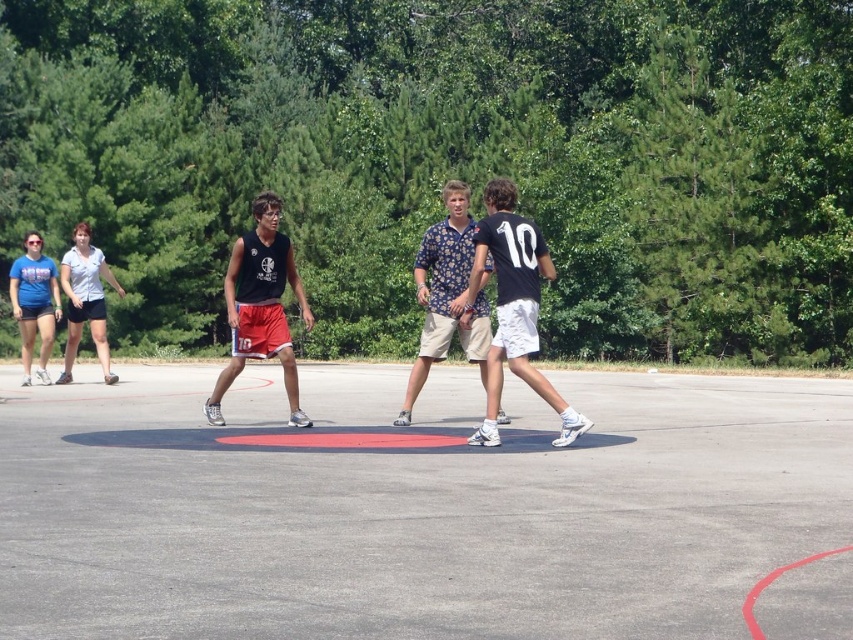
Is matte black tank top at center below matte blue t-shirt at left?

No, matte black tank top at center is not below matte blue t-shirt at left.

Measure the distance between matte black tank top at center and camera.

11.74 meters

Does point (293, 362) lie in front of point (41, 307)?

Yes.

At what (x,y) coordinates should I click in order to perform the action: click on matte black tank top at center. Please return your answer as a coordinate pair (x, y). Image resolution: width=853 pixels, height=640 pixels. Looking at the image, I should click on (260, 305).

Can you confirm if gray concrete court at center is shorter than black matte jersey at center?

Yes, gray concrete court at center is shorter than black matte jersey at center.

Who is lower down, gray concrete court at center or black matte jersey at center?

gray concrete court at center is lower down.

Locate an element on the screen. The image size is (853, 640). gray concrete court at center is located at coordinates (410, 506).

The height and width of the screenshot is (640, 853). I want to click on gray concrete court at center, so click(x=410, y=506).

Between floral-patterned shirt at center and matte blue t-shirt at left, which one appears on the right side from the viewer's perspective?

Positioned to the right is floral-patterned shirt at center.

Is point (469, 321) farther from viewer compared to point (13, 260)?

No.

Find the location of `floral-patterned shirt at center`. floral-patterned shirt at center is located at coordinates (445, 294).